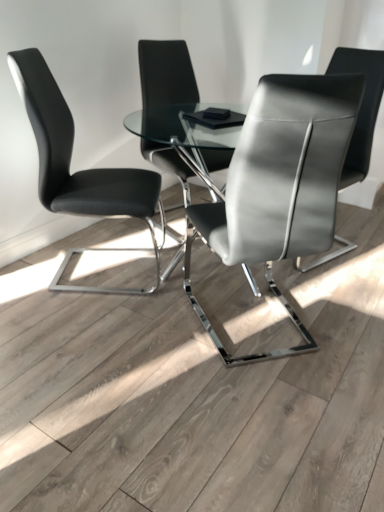
Where is `free space that is to the left of satin gray leather chair at center, marked as the second chair in a right-to-left arrangement`? free space that is to the left of satin gray leather chair at center, marked as the second chair in a right-to-left arrangement is located at coordinates (134, 330).